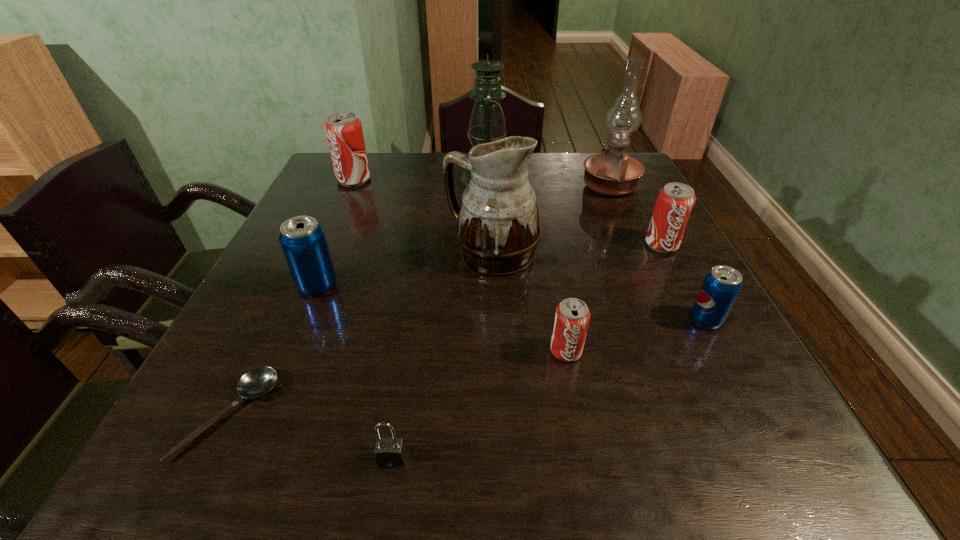
I want to click on free space at the right edge, so click(x=652, y=259).

Where is `vacant space at the far left corner of the desktop`? This screenshot has width=960, height=540. vacant space at the far left corner of the desktop is located at coordinates (321, 171).

The height and width of the screenshot is (540, 960). I want to click on free region at the near left corner of the desktop, so click(224, 432).

What are the coordinates of `unoccupied position between the gray ladle and the pitcher` in the screenshot? It's located at (360, 334).

Identify the location of vacant space that is in between the second nearest pink soda can and the smaller blue pop soda. (684, 282).

Locate an element on the screen. vacant point located between the left blue pop soda and the left oil lamp is located at coordinates (402, 233).

Find the location of `unoccupied area between the second nearest soda can and the padlock`. unoccupied area between the second nearest soda can and the padlock is located at coordinates pyautogui.click(x=549, y=389).

Where is `free space that is in between the gray ladle and the smaller blue pop soda`? The image size is (960, 540). free space that is in between the gray ladle and the smaller blue pop soda is located at coordinates (468, 367).

Point out which object is positioned as the ninth nearest to the seventh shortest object. Please provide its 2D coordinates. Your answer should be formatted as a tuple, i.e. [(x, y)], where the tuple contains the x and y coordinates of a point satisfying the conditions above.

[(721, 286)]

Where is `object that is the second nearest to the left oil lamp`? This screenshot has height=540, width=960. object that is the second nearest to the left oil lamp is located at coordinates (612, 173).